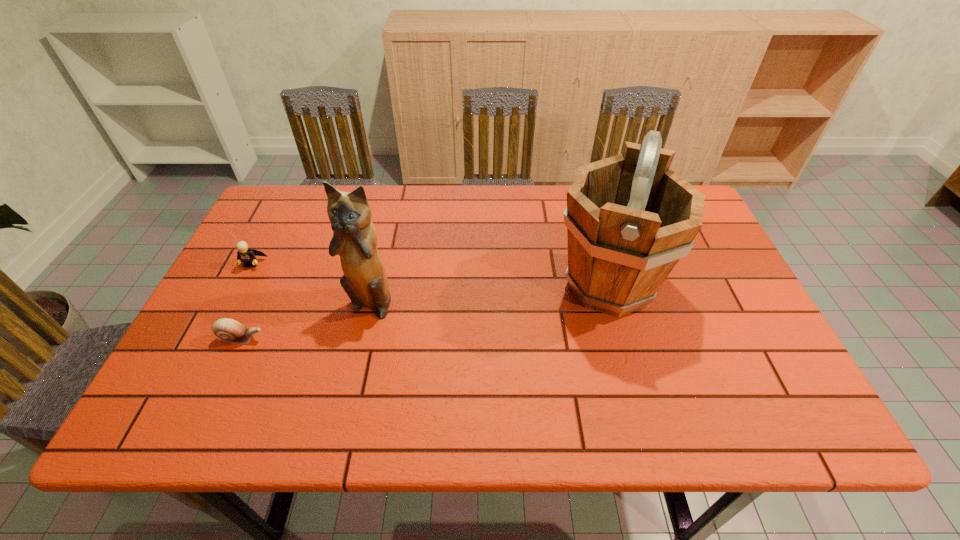
The width and height of the screenshot is (960, 540). Find the location of `Lego located in the left edge section of the desktop`. Lego located in the left edge section of the desktop is located at coordinates (248, 256).

You are a GUI agent. You are given a task and a screenshot of the screen. Output one action in this format:
    pyautogui.click(x=<x>, y=<y>)
    Task: Click on the escargot that is at the left edge
    
    Given the screenshot: What is the action you would take?
    pyautogui.click(x=229, y=330)

In the image, there is a desktop. Where is `vacant space at the far edge`? Image resolution: width=960 pixels, height=540 pixels. vacant space at the far edge is located at coordinates (446, 195).

Find the location of a particular element. vacant space at the near edge of the desktop is located at coordinates (363, 413).

This screenshot has width=960, height=540. What are the coordinates of `vacant space at the left edge` in the screenshot? It's located at (246, 279).

At what (x,y) coordinates should I click in order to perform the action: click on free space at the right edge. Please return your answer as a coordinate pair (x, y). The height and width of the screenshot is (540, 960). Looking at the image, I should click on (687, 304).

The width and height of the screenshot is (960, 540). In the image, there is a desktop. What are the coordinates of `vacant space at the near left corner` in the screenshot? It's located at (202, 408).

Where is `free spot between the tallest object and the third tallest object`? This screenshot has width=960, height=540. free spot between the tallest object and the third tallest object is located at coordinates (430, 275).

Locate an element on the screen. empty location between the bucket and the escargot is located at coordinates (425, 312).

Where is `free space between the third shortest object and the Lego`? free space between the third shortest object and the Lego is located at coordinates (311, 282).